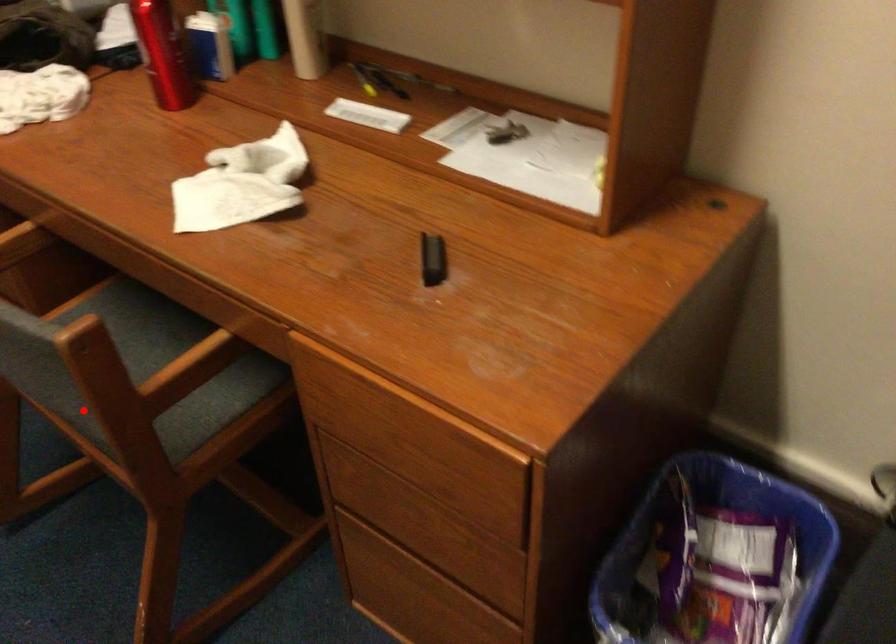
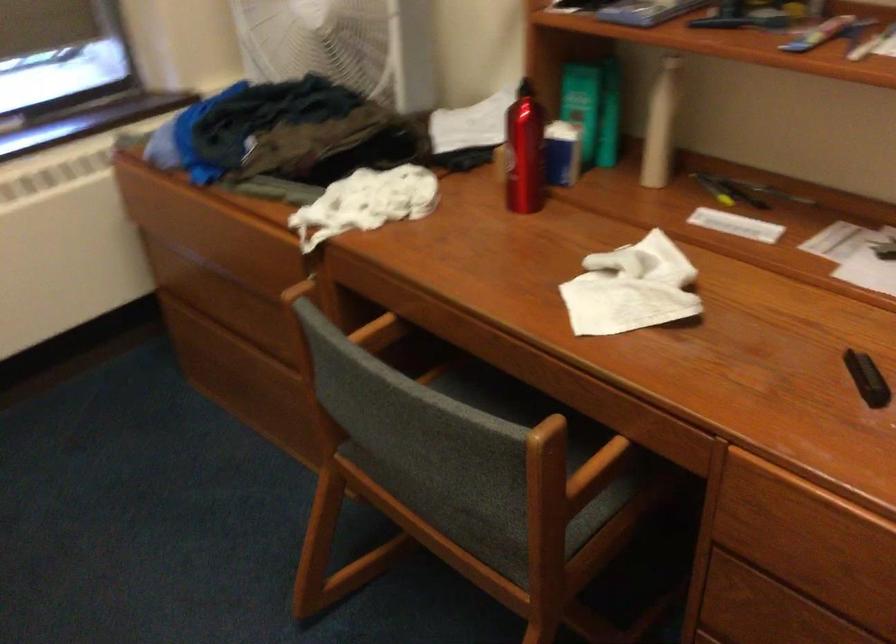
In the second image, find the point that corresponds to the highlighted location in the first image.

(488, 509)